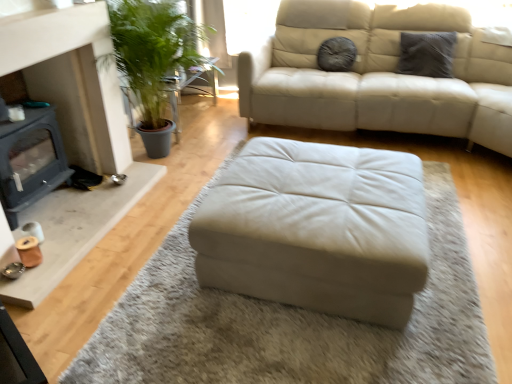
Question: Considering the positions of gray textured pillow at upper right, arranged as the 2th pillow when viewed from the left, and green leafy plant at left in the image, is gray textured pillow at upper right, arranged as the 2th pillow when viewed from the left, wider or thinner than green leafy plant at left?

Choices:
 (A) thin
 (B) wide

Answer: (A)

Question: Would you say gray textured pillow at upper right, arranged as the 2th pillow when viewed from the left, is inside or outside green leafy plant at left?

Choices:
 (A) outside
 (B) inside

Answer: (A)

Question: Based on their relative distances, which object is nearer to the green leafy plant at left?

Choices:
 (A) beige leather ottoman at center
 (B) gray textured pillow at upper right, acting as the first pillow starting from the right
 (C) beige leather ottoman at center
 (D) fuzzy gray pillow at upper center, which is counted as the second pillow, starting from the right
 (E) matte gray fireplace at lower left

Answer: (D)

Question: Which object is positioned farthest from the beige leather ottoman at center?

Choices:
 (A) matte gray fireplace at lower left
 (B) green leafy plant at left
 (C) beige leather ottoman at center
 (D) gray textured pillow at upper right, acting as the first pillow starting from the right
 (E) fuzzy gray pillow at upper center, which is the 1th pillow from left to right

Answer: (B)